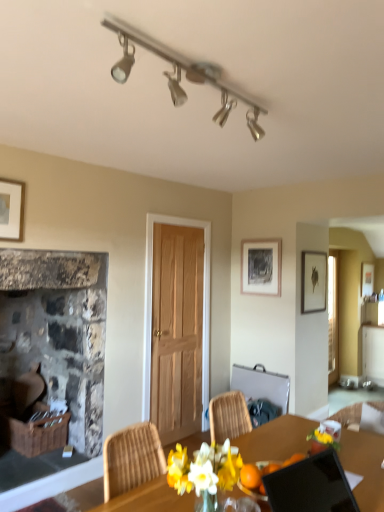
Question: In the image, is metallic silver chair at center positioned in front of or behind rustic stone fireplace at left?

Choices:
 (A) front
 (B) behind

Answer: (B)

Question: Considering the positions of metallic silver chair at center and rustic stone fireplace at left in the image, is metallic silver chair at center taller or shorter than rustic stone fireplace at left?

Choices:
 (A) short
 (B) tall

Answer: (A)

Question: Which is farther from the matte black picture frame at upper center, placed as the first picture frame when sorted from left to right?

Choices:
 (A) satin nickel track light at upper center
 (B) metallic silver chair at center
 (C) rustic stone fireplace at left
 (D) matte black picture frame at upper right, acting as the 1th picture frame starting from the right
 (E) black glossy laptop at lower right

Answer: (E)

Question: Estimate the real-world distances between objects in this image. Which object is closer to the rustic stone fireplace at left?

Choices:
 (A) satin nickel track light at upper center
 (B) metallic silver chair at center
 (C) matte black picture frame at upper right, the second picture frame when ordered from left to right
 (D) black glossy laptop at lower right
 (E) matte black picture frame at upper center, placed as the first picture frame when sorted from left to right

Answer: (B)